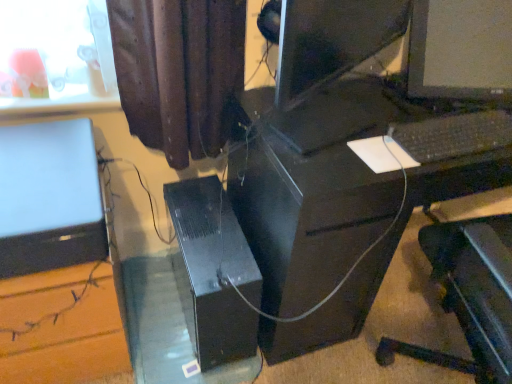
This screenshot has height=384, width=512. What do you see at coordinates (450, 136) in the screenshot?
I see `black plastic keyboard at center` at bounding box center [450, 136].

What are the coordinates of `black plastic computer tower at center` in the screenshot? It's located at (213, 272).

The width and height of the screenshot is (512, 384). I want to click on black plastic computer desk at center, so click(x=345, y=198).

Identify the location of black plastic keyboard at center. The width and height of the screenshot is (512, 384). coord(450,136).

Can you confirm if black plastic computer desk at center is thinner than black plastic computer tower at center?

In fact, black plastic computer desk at center might be wider than black plastic computer tower at center.

From the image's perspective, would you say black plastic computer desk at center is shown under black plastic computer tower at center?

Actually, black plastic computer desk at center appears above black plastic computer tower at center in the image.

Based on the photo, is the depth of black plastic computer desk at center greater than that of black plastic computer tower at center?

That is False.

Can you see black plastic computer desk at center touching black plastic computer tower at center?

black plastic computer desk at center and black plastic computer tower at center are not in contact.

Is black plastic keyboard at center completely or partially outside of satin silver laptop at left?

Absolutely, black plastic keyboard at center is external to satin silver laptop at left.

From the picture: From a real-world perspective, is black plastic keyboard at center positioned under satin silver laptop at left based on gravity?

No, from a real-world perspective, black plastic keyboard at center is not below satin silver laptop at left.

Between black plastic keyboard at center and satin silver laptop at left, which one has larger width?

satin silver laptop at left.

Considering the positions of objects black plastic keyboard at center and satin silver laptop at left in the image provided, who is more to the right, black plastic keyboard at center or satin silver laptop at left?

From the viewer's perspective, black plastic keyboard at center appears more on the right side.

Would you say black plastic computer tower at center is inside or outside black plastic computer desk at center?

black plastic computer tower at center lies outside black plastic computer desk at center.

From a real-world perspective, who is located lower, black plastic computer tower at center or black plastic computer desk at center?

black plastic computer tower at center.

From the image's perspective, between black plastic computer tower at center and black plastic computer desk at center, which one is located above?

From the image's view, black plastic computer desk at center is above.

Is point (42, 200) closer or farther from the camera than point (486, 140)?

Point (42, 200) is positioned closer to the camera compared to point (486, 140).

Which of these two, satin silver laptop at left or black plastic keyboard at center, stands shorter?

black plastic keyboard at center is shorter.

Looking at their sizes, would you say satin silver laptop at left is wider or thinner than black plastic keyboard at center?

Considering their sizes, satin silver laptop at left looks broader than black plastic keyboard at center.

Is satin silver laptop at left oriented towards black plastic keyboard at center?

No, satin silver laptop at left is not turned towards black plastic keyboard at center.

Is black plastic keyboard at center located within black plastic computer desk at center?

No, black plastic computer desk at center does not contain black plastic keyboard at center.

From a real-world perspective, which is physically above, black plastic computer desk at center or black plastic keyboard at center?

In real-world perspective, black plastic keyboard at center is above.

Could you tell me if black plastic computer desk at center is facing black plastic keyboard at center?

No, black plastic computer desk at center does not turn towards black plastic keyboard at center.

Based on their sizes in the image, would you say black plastic computer desk at center is bigger or smaller than black plastic keyboard at center?

In the image, black plastic computer desk at center appears to be larger than black plastic keyboard at center.

Can you see satin silver laptop at left touching black plastic computer desk at center?

No.

From the image's perspective, is satin silver laptop at left above or below black plastic computer desk at center?

satin silver laptop at left is above black plastic computer desk at center.

Where is `computer monitor to the left of black plastic computer desk at center`? computer monitor to the left of black plastic computer desk at center is located at coordinates (48, 177).

Is satin silver laptop at left wider or thinner than black plastic computer desk at center?

satin silver laptop at left is thinner than black plastic computer desk at center.

Based on the photo, considering the relative sizes of black plastic computer desk at center and satin silver laptop at left in the image provided, is black plastic computer desk at center bigger than satin silver laptop at left?

Yes, black plastic computer desk at center is bigger than satin silver laptop at left.

Is black plastic computer desk at center to the left of satin silver laptop at left from the viewer's perspective?

No, black plastic computer desk at center is not to the left of satin silver laptop at left.

Is point (367, 107) closer or farther from the camera than point (47, 169)?

Point (367, 107) is farther from the camera than point (47, 169).

Where is `computer tower below the black plastic computer desk at center (from the image's perspective)`? Image resolution: width=512 pixels, height=384 pixels. computer tower below the black plastic computer desk at center (from the image's perspective) is located at coordinates (213, 272).

In the image, there is a satin silver laptop at left. Find the location of `computer keyboard above it (from the image's perspective)`. computer keyboard above it (from the image's perspective) is located at coordinates (450, 136).

When comparing their distances from black plastic computer tower at center, does black plastic keyboard at center or satin silver laptop at left seem closer?

satin silver laptop at left is positioned closer to the anchor black plastic computer tower at center.

Looking at the image, which one is located closer to satin silver laptop at left, black plastic keyboard at center or black plastic computer desk at center?

The object closer to satin silver laptop at left is black plastic computer desk at center.

From the image, which object appears to be farther from satin silver laptop at left, black plastic computer tower at center or black plastic computer desk at center?

black plastic computer desk at center lies further to satin silver laptop at left than the other object.

From the image, which object appears to be nearer to black plastic computer tower at center, black plastic computer desk at center or black plastic keyboard at center?

black plastic computer desk at center.

Which object lies further to the anchor point black plastic computer tower at center, black plastic keyboard at center or black plastic computer desk at center?

Based on the image, black plastic keyboard at center appears to be further to black plastic computer tower at center.

Based on their spatial positions, is satin silver laptop at left or black plastic keyboard at center closer to black plastic computer desk at center?

black plastic keyboard at center.

Which object lies nearer to the anchor point satin silver laptop at left, black plastic computer tower at center or black plastic keyboard at center?

black plastic computer tower at center is positioned closer to the anchor satin silver laptop at left.

Which object lies nearer to the anchor point black plastic keyboard at center, black plastic computer desk at center or black plastic computer tower at center?

black plastic computer desk at center.

The height and width of the screenshot is (384, 512). In order to click on computer desk between satin silver laptop at left and black plastic keyboard at center in the horizontal direction in this screenshot , I will do `click(345, 198)`.

At what (x,y) coordinates should I click in order to perform the action: click on computer tower located between satin silver laptop at left and black plastic keyboard at center in the left-right direction. Please return your answer as a coordinate pair (x, y). Looking at the image, I should click on (213, 272).

What are the coordinates of `computer tower situated between satin silver laptop at left and black plastic computer desk at center from left to right` in the screenshot? It's located at (213, 272).

Locate an element on the screen. The height and width of the screenshot is (384, 512). computer desk situated between black plastic computer tower at center and black plastic keyboard at center from left to right is located at coordinates (345, 198).